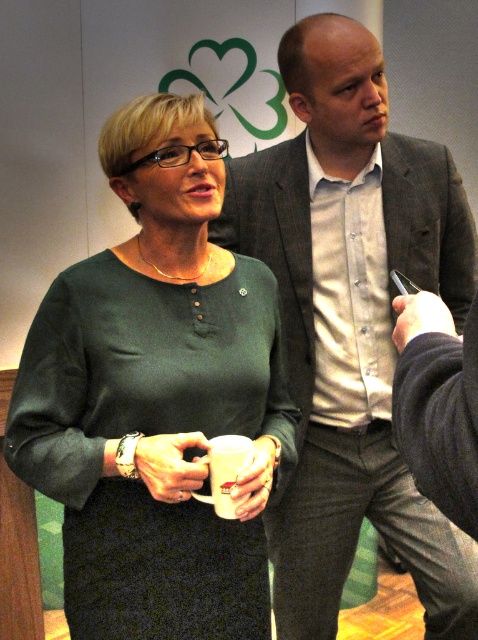
You are at the point labeled point (202,611) and want to move to the point labeled point (221,477). Which direction should you move in to reach your destination?

You should move forward because point (202,611) is behind point (221,477), so moving forward from point (202,611) will take you toward point (221,477).

You are organizing a photo shoot and need to place a matte gray suit at center and a white matte mug at center on a table. Which object should you place first to ensure proper spacing between them?

The matte gray suit at center is wider than the white matte mug at center, so you should place the matte gray suit at center first to ensure proper spacing between them.

What object is located at the coordinates point (155, 397) in the image?

The point (155, 397) corresponds to the matte green dress at center.